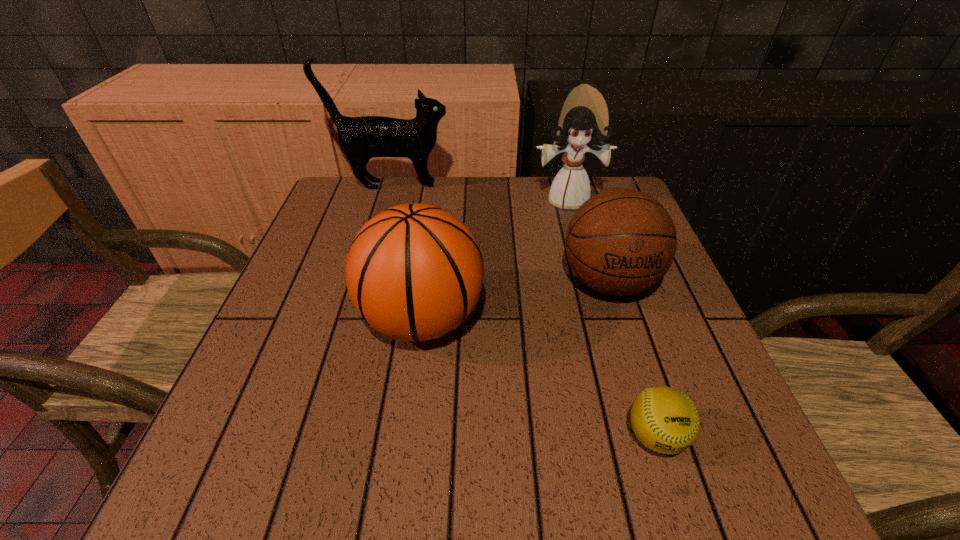
The height and width of the screenshot is (540, 960). In order to click on object positioned at the near right corner in this screenshot , I will do `click(665, 420)`.

Find the location of a particular element. blank space at the far edge is located at coordinates (532, 199).

I want to click on vacant space at the near edge of the desktop, so click(x=611, y=451).

The height and width of the screenshot is (540, 960). What are the coordinates of `vacant space at the left edge` in the screenshot? It's located at (313, 404).

Identify the location of vacant space at the right edge. (713, 357).

Find the location of `vacant space at the far left corner of the desktop`. vacant space at the far left corner of the desktop is located at coordinates (317, 224).

I want to click on free space at the far right corner of the desktop, so click(x=592, y=180).

In the image, there is a desktop. At what (x,y) coordinates should I click in order to perform the action: click on vacant space at the near right corner. Please return your answer as a coordinate pair (x, y). Looking at the image, I should click on (691, 451).

This screenshot has height=540, width=960. I want to click on free point between the nearest object and the doll, so click(612, 318).

Locate an element on the screen. This screenshot has height=540, width=960. vacant area between the shortest object and the left basketball is located at coordinates (539, 377).